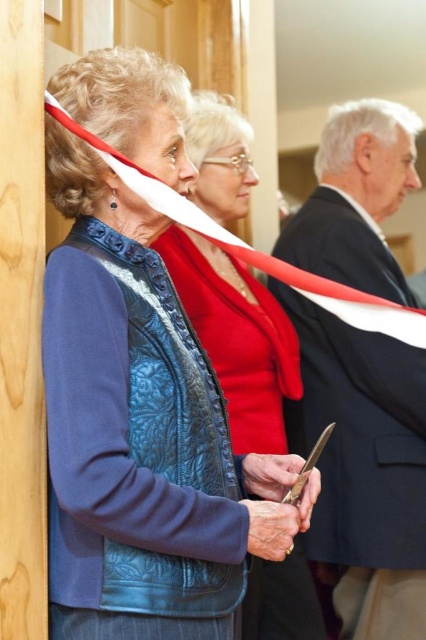
You are organizing a photo shoot and need to arrange the dark gray suit at right and the blue quilted leather jacket at center based on their sizes. Which clothing item should you place on the wider rack?

The dark gray suit at right should be placed on the wider rack because its width surpasses the blue quilted leather jacket at center.

You are attending a ribbon cutting ceremony and need to determine the spatial relationship between the dark gray suit at right and the blue quilted leather jacket at center. Which object is located lower in the image?

The dark gray suit at right is positioned under the blue quilted leather jacket at center, so the dark gray suit at right is located lower in the image.

You are a photographer at a ribbon cutting ceremony. You want to capture a photo of the dark gray suit at right and the blue quilted leather jacket at center. The camera you are using has a minimum focus distance of 10 inches. Will you be able to focus on both subjects at the same time?

The dark gray suit at right and blue quilted leather jacket at center are 11.09 inches apart, which is greater than the camera minimum focus distance of 10 inches. Therefore, the photographer can focus on both subjects simultaneously.